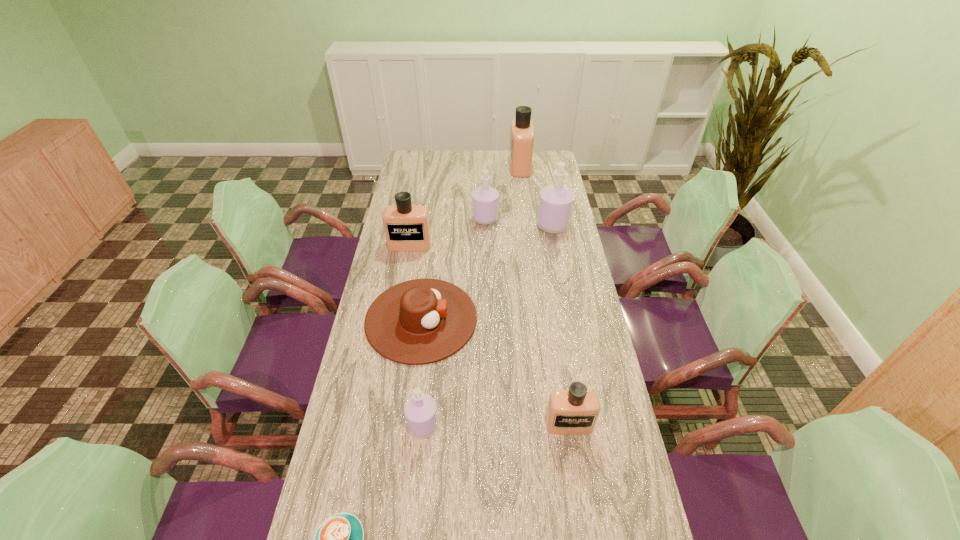
Locate an element on the screen. This screenshot has width=960, height=540. free space located on the front-facing side of the second shortest object is located at coordinates (500, 319).

Identify the location of object situated at the far edge. (522, 131).

In order to click on perfume at the left edge in this screenshot , I will do `click(406, 226)`.

Locate an element on the screen. The height and width of the screenshot is (540, 960). cowboy hat located in the left edge section of the desktop is located at coordinates (420, 321).

The image size is (960, 540). Identify the location of object that is at the far right corner. (522, 131).

Locate an element on the screen. Image resolution: width=960 pixels, height=540 pixels. free space at the left edge is located at coordinates (395, 366).

This screenshot has height=540, width=960. I want to click on free space at the right edge of the desktop, so click(x=602, y=407).

Where is `vacant space at the far left corner`? This screenshot has height=540, width=960. vacant space at the far left corner is located at coordinates (427, 158).

In the image, there is a desktop. At what (x,y) coordinates should I click in order to perform the action: click on vacant space at the far right corner. Please return your answer as a coordinate pair (x, y). This screenshot has width=960, height=540. Looking at the image, I should click on (548, 167).

Locate an element on the screen. The height and width of the screenshot is (540, 960). free space that is in between the second smallest beige perfume and the third perfume from left to right is located at coordinates (447, 232).